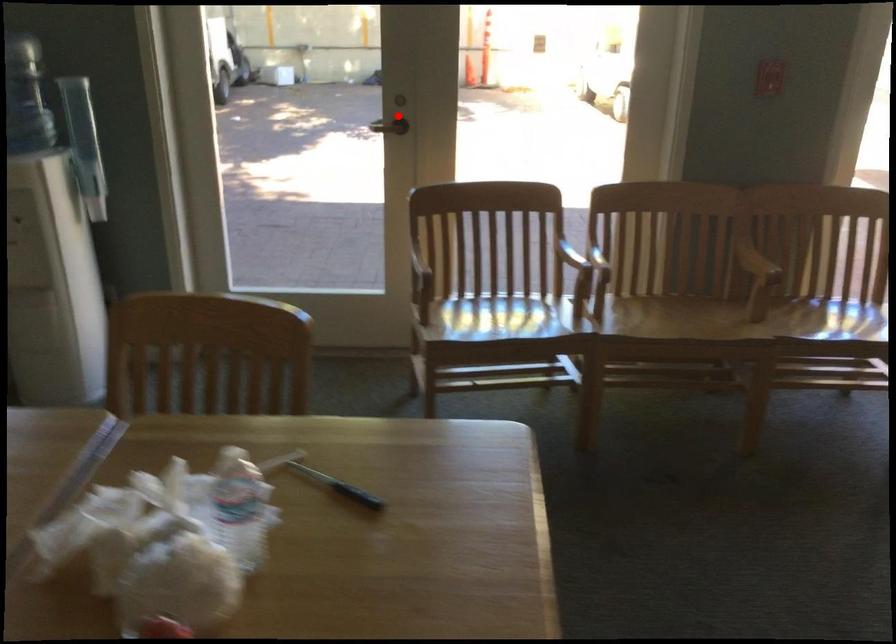
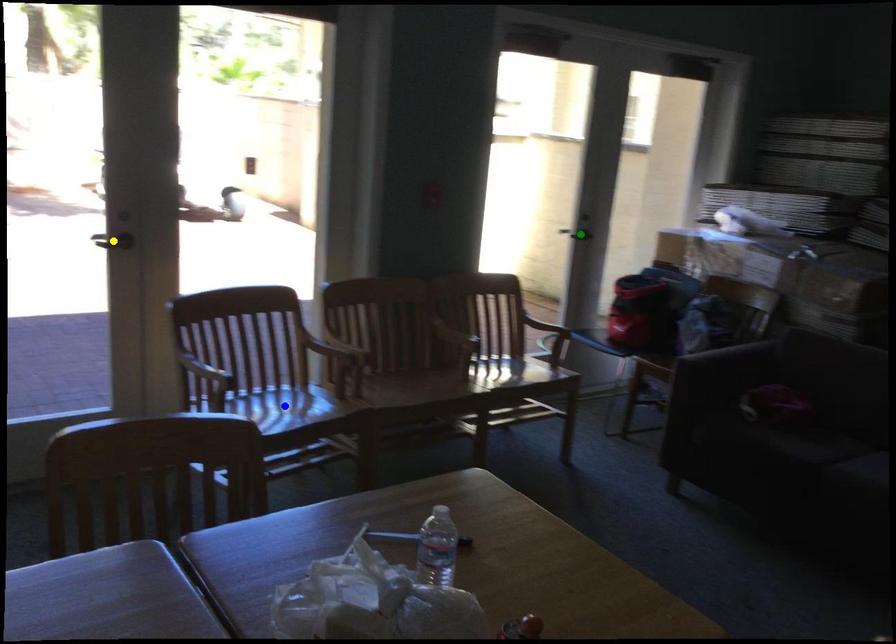
Question: I am providing you with two images of the same scene from different viewpoints. A red point is marked on the first image. You are given multiple points on the second image. Which spot in image 2 lines up with the point in image 1?

Choices:
 (A) yellow point
 (B) green point
 (C) blue point

Answer: (A)